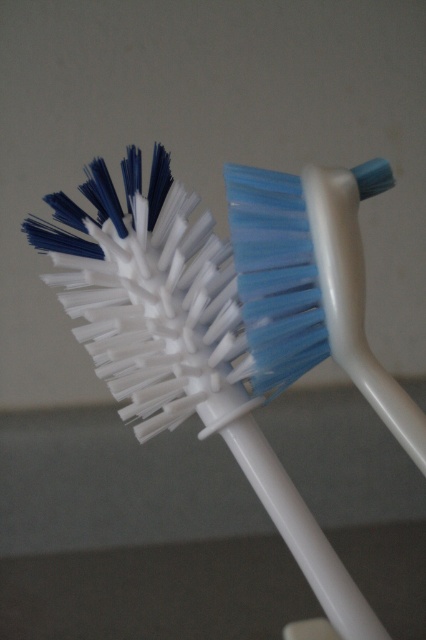
You are trying to determine which toothbrush is closer to you. You see the white plastic toothbrush at center and the blue plastic toothbrush at center. Which one is closer?

The white plastic toothbrush at center is closer because the blue plastic toothbrush at center is behind it.

You are organizing a bathroom drawer and notice two toothbrushes in the image. Which one is positioned lower between the white plastic toothbrush at center and the blue plastic toothbrush at center?

The white plastic toothbrush at center is positioned lower than the blue plastic toothbrush at center according to the description.

You are holding a camera and want to take a photo of the white plastic toothbrush at center. If your camera requires the subject to be at least 24 inches away for clear focus, will you need to move closer or farther away?

The white plastic toothbrush at center and camera are 22.99 inches apart from each other. Since 22.99 inches is less than 24 inches, you need to move farther away to achieve clear focus.